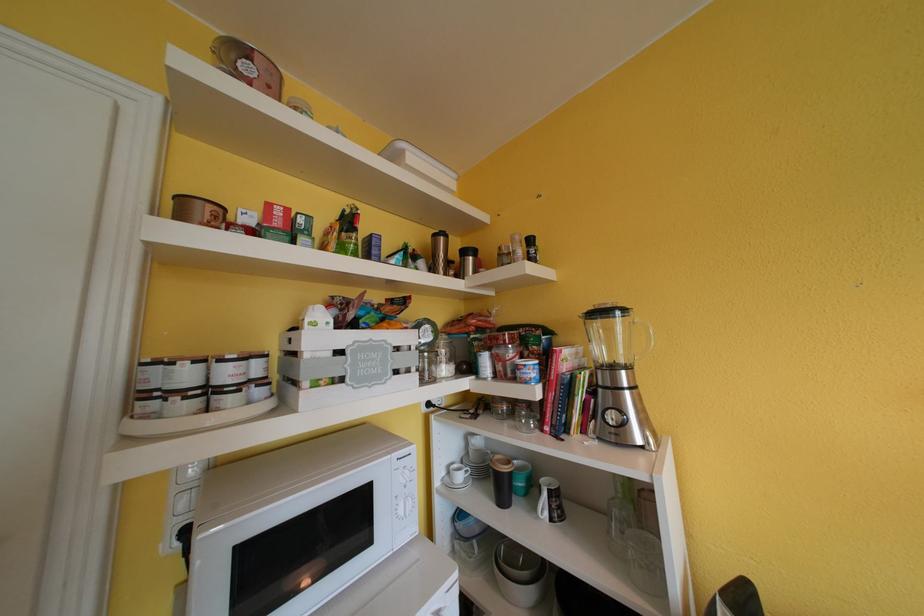
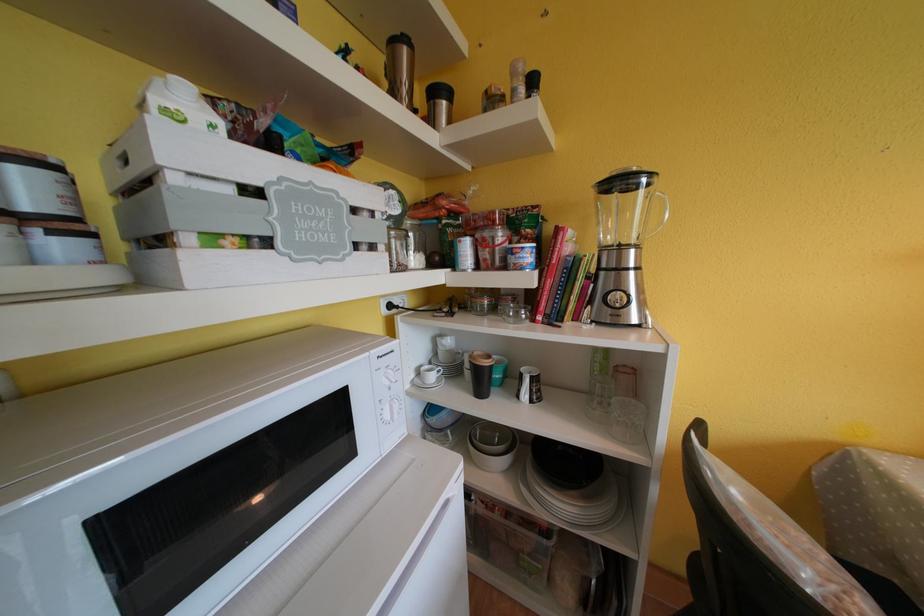
Where in the second image is the point corresponding to the point at 408,516 from the first image?

(394, 421)